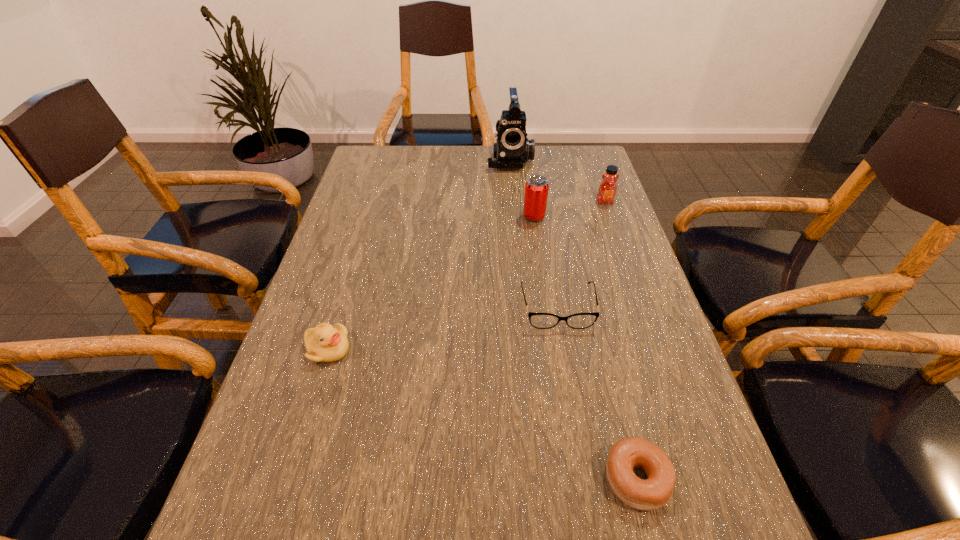
Image resolution: width=960 pixels, height=540 pixels. Identify the location of the tallest object. (513, 149).

Find the location of a particular element. This screenshot has height=540, width=960. camcorder is located at coordinates (513, 149).

Where is `the fourth nearest object`? The image size is (960, 540). the fourth nearest object is located at coordinates (536, 188).

The height and width of the screenshot is (540, 960). In order to click on honey in this screenshot , I will do `click(608, 189)`.

Where is `the second farthest object`? The image size is (960, 540). the second farthest object is located at coordinates (608, 189).

Locate an element on the screen. the fifth farthest object is located at coordinates (325, 343).

Locate an element on the screen. duckling is located at coordinates (325, 343).

Where is `the nearest object`? This screenshot has width=960, height=540. the nearest object is located at coordinates (631, 453).

Locate an element on the screen. the fourth farthest object is located at coordinates (538, 320).

Identify the location of blank area located on the lens mount of the tallest object. (516, 231).